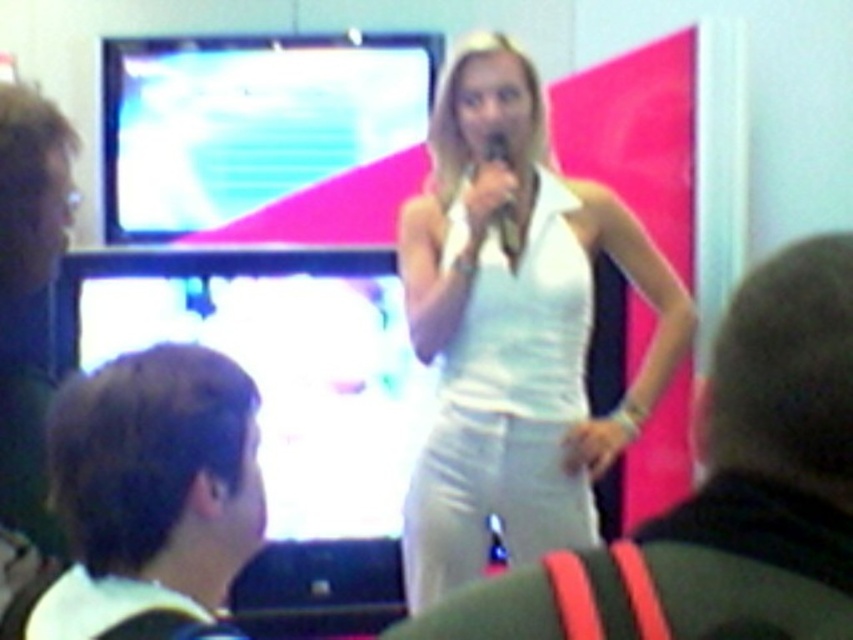
Question: Which of the following is the closest to the observer?

Choices:
 (A) white fabric shirt at center
 (B) matte black microphone at center
 (C) brown hair at lower left
 (D) white smooth dress at center

Answer: (A)

Question: Which object is positioned farthest from the brown hair at lower left?

Choices:
 (A) matte black microphone at center
 (B) white fabric shirt at center
 (C) white smooth dress at center

Answer: (A)

Question: Does brown hair at lower left appear over matte black microphone at center?

Choices:
 (A) no
 (B) yes

Answer: (A)

Question: Does brown hair at lower left have a larger size compared to matte black microphone at center?

Choices:
 (A) no
 (B) yes

Answer: (B)

Question: Can you confirm if white fabric shirt at center is smaller than brown hair at lower left?

Choices:
 (A) no
 (B) yes

Answer: (B)

Question: Which of the following is the closest to the observer?

Choices:
 (A) white smooth dress at center
 (B) brown hair at lower left
 (C) matte black microphone at center
 (D) white fabric shirt at center

Answer: (D)